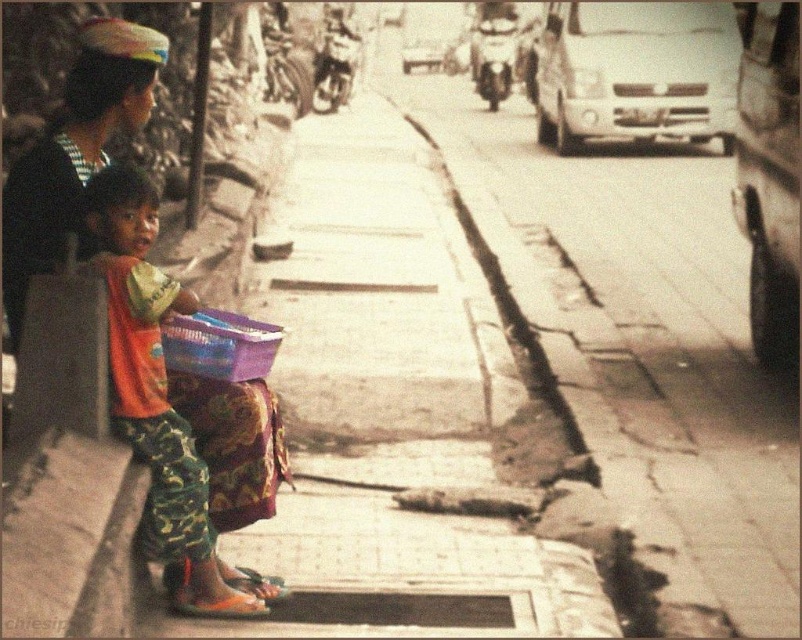
Question: Which point is closer to the camera?

Choices:
 (A) (140, 193)
 (B) (756, 600)

Answer: (A)

Question: Can you confirm if smooth concrete pavement at center is positioned above purple woven basket at lower center?

Choices:
 (A) no
 (B) yes

Answer: (B)

Question: Does cracked concrete sidewalk at center appear under camouflage pants at left?

Choices:
 (A) yes
 (B) no

Answer: (B)

Question: Is cracked concrete sidewalk at center to the left of camouflage pants at left from the viewer's perspective?

Choices:
 (A) yes
 (B) no

Answer: (B)

Question: Which object appears closest to the camera in this image?

Choices:
 (A) smooth concrete pavement at center
 (B) purple woven basket at lower center
 (C) camouflage pants at left

Answer: (C)

Question: Estimate the real-world distances between objects in this image. Which object is farther from the camouflage pants at left?

Choices:
 (A) cracked concrete sidewalk at center
 (B) smooth concrete pavement at center
 (C) purple woven basket at lower center

Answer: (A)